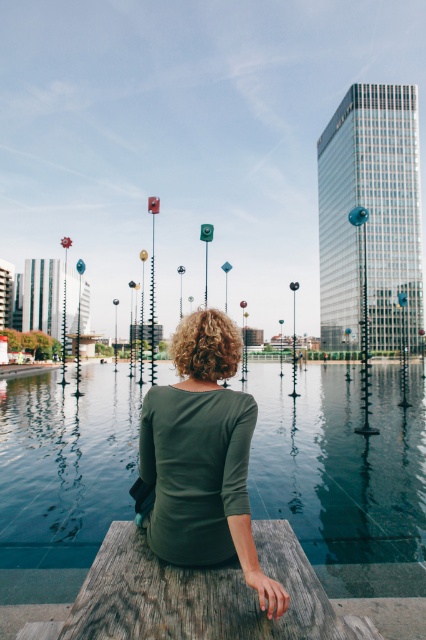
Looking at this image, you are standing at the point marked as point (344, 476) in the image. What is the surface you are standing on?

The point (344, 476) is on transparent glass water at center, so you are standing on transparent glass water at center.

You are a city planner analyzing this urban scene. You need to place a new bench exactly where the transparent glass water at center is located. Is this feasible given the water is at that location?

The transparent glass water at center is located at point (x=344, y=476), so placing a bench there would not be feasible since the area is covered by water.

Based on the photo, you are standing in the park and see a person sitting on a bench. They are wearing a green matte shirt at center and there is transparent glass water at center. Which object is positioned to the right of the other?

The transparent glass water at center is to the right of the green matte shirt at center.